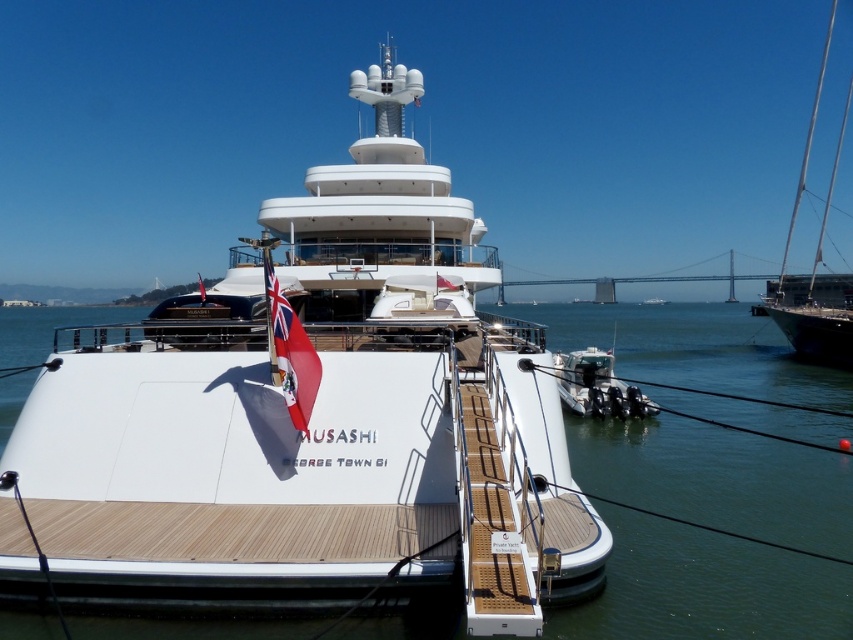
Question: Which object is the closest to the metallic silver mast at right?

Choices:
 (A) red fabric flag at lower left
 (B) white glossy yacht at center
 (C) white wooden deck at center

Answer: (B)

Question: Can you confirm if white glossy yacht at center is positioned to the right of white wooden deck at center?

Choices:
 (A) yes
 (B) no

Answer: (B)

Question: Which point appears farthest from the camera in this image?

Choices:
 (A) (306, 385)
 (B) (614, 348)
 (C) (850, 342)
 (D) (438, 582)

Answer: (B)

Question: Can you confirm if white wooden deck at center is positioned to the left of metallic silver mast at right?

Choices:
 (A) yes
 (B) no

Answer: (A)

Question: Can you confirm if white glossy yacht at center is positioned below metallic silver mast at right?

Choices:
 (A) yes
 (B) no

Answer: (A)

Question: Which object appears farthest from the camera in this image?

Choices:
 (A) red fabric flag at lower left
 (B) metallic silver mast at right
 (C) white glossy yacht at center

Answer: (B)